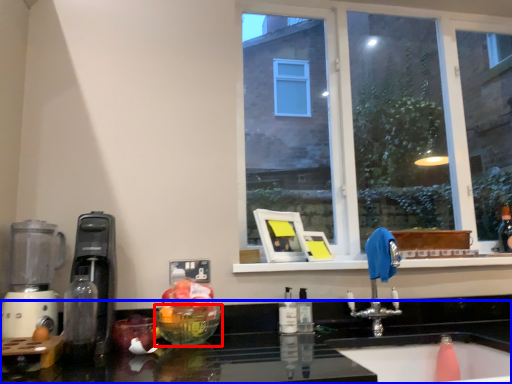
Question: Which point is closer to the camera, glass bowl (highlighted by a red box) or countertop (highlighted by a blue box)?

Choices:
 (A) glass bowl
 (B) countertop

Answer: (B)